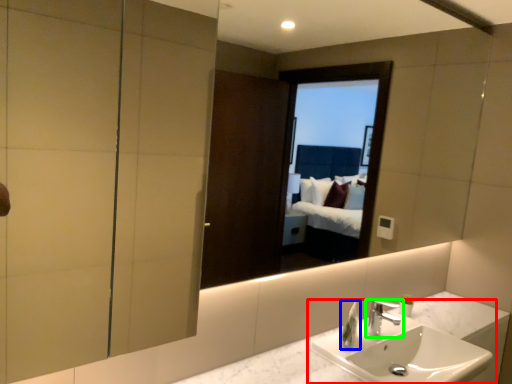
Question: Which object is the closest to the sink (highlighted by a red box)? Choose among these: soap dispenser (highlighted by a blue box) or tap (highlighted by a green box).

Choices:
 (A) soap dispenser
 (B) tap

Answer: (B)